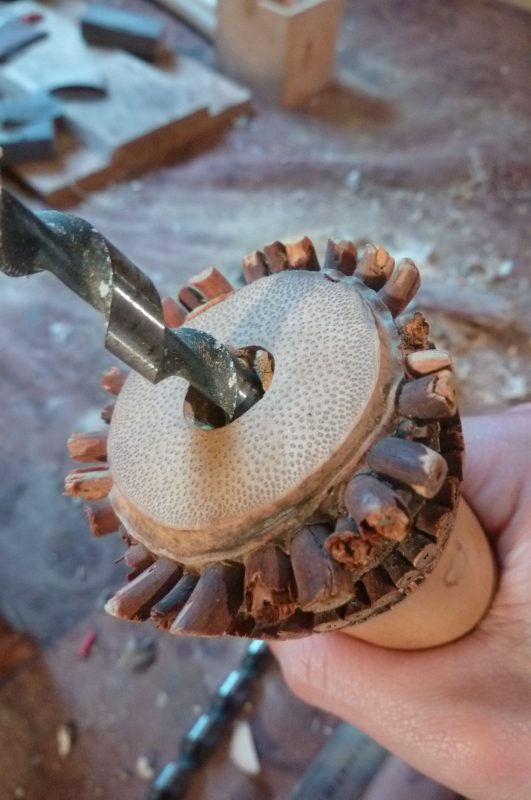
At what (x,y) coordinates should I click in order to perform the action: click on wood base. Please return your answer as a coordinate pair (x, y). The image size is (531, 800). Looking at the image, I should click on (455, 600).